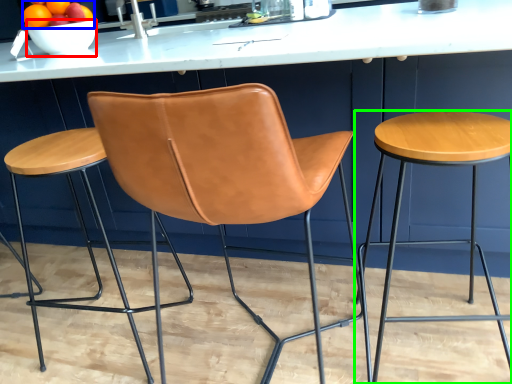
Question: Based on their relative distances, which object is nearer to bowl (highlighted by a red box)? Choose from fruit (highlighted by a blue box) and stool (highlighted by a green box).

Choices:
 (A) fruit
 (B) stool

Answer: (A)